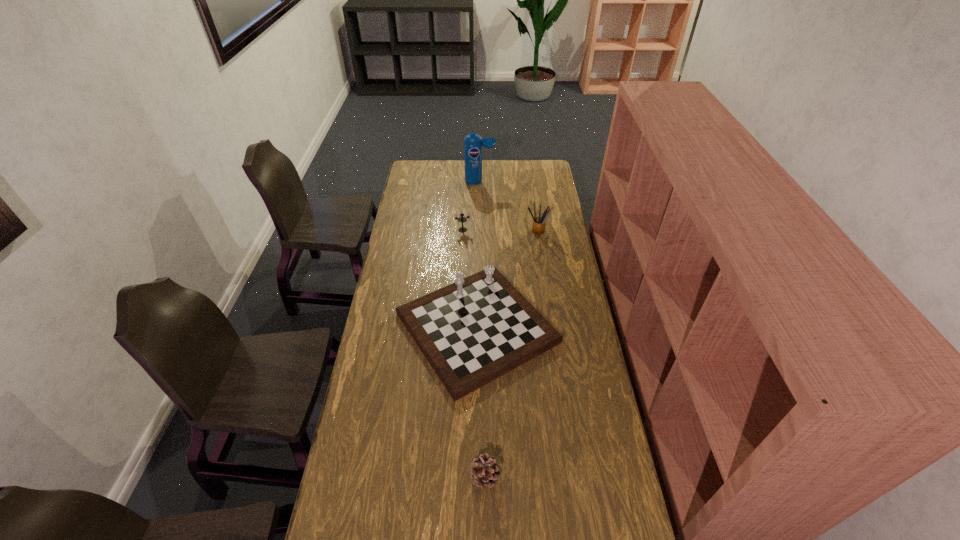
Identify the location of free space located on the front of the candle holder. (462, 254).

At what (x,y) coordinates should I click in order to perform the action: click on free spot located 0.320m on the back of the nearest object. Please return your answer as a coordinate pair (x, y). This screenshot has width=960, height=540. Looking at the image, I should click on (485, 375).

I want to click on object present at the far edge, so click(x=473, y=143).

The height and width of the screenshot is (540, 960). What are the coordinates of `object present at the left edge` in the screenshot? It's located at (473, 331).

Identify the location of pencil box that is at the right edge. [539, 222].

What are the coordinates of `gameboard at the right edge` in the screenshot? It's located at (473, 331).

Locate an element on the screen. free space at the left edge is located at coordinates (381, 525).

The width and height of the screenshot is (960, 540). In order to click on free space at the right edge of the desktop in this screenshot , I will do `click(586, 464)`.

The width and height of the screenshot is (960, 540). In order to click on vacant space at the far left corner of the desktop in this screenshot , I will do `click(420, 167)`.

The height and width of the screenshot is (540, 960). Identify the location of free area in between the second shortest object and the pencil box. (500, 231).